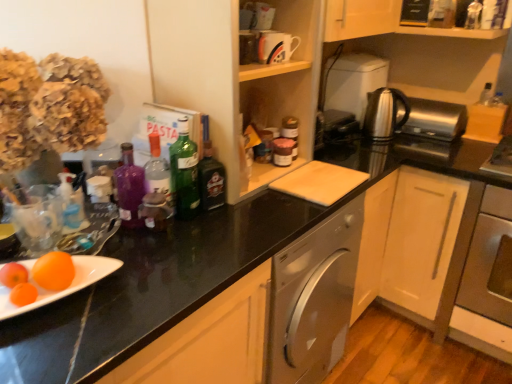
Question: From the image's perspective, would you say glossy ceramic mug at upper center, the third appliance in the right-to-left sequence, is shown under stainless steel oven at lower right?

Choices:
 (A) yes
 (B) no

Answer: (B)

Question: From a real-world perspective, is glossy ceramic mug at upper center, marked as the 1th appliance in a front-to-back arrangement, on stainless steel oven at lower right?

Choices:
 (A) yes
 (B) no

Answer: (A)

Question: From a real-world perspective, does glossy ceramic mug at upper center, the first appliance from the left, sit lower than stainless steel oven at lower right?

Choices:
 (A) no
 (B) yes

Answer: (A)

Question: Is glossy ceramic mug at upper center, the third appliance in the right-to-left sequence, taller than stainless steel oven at lower right?

Choices:
 (A) no
 (B) yes

Answer: (A)

Question: Considering the relative sizes of glossy ceramic mug at upper center, the third appliance in the right-to-left sequence, and stainless steel oven at lower right in the image provided, is glossy ceramic mug at upper center, the third appliance in the right-to-left sequence, bigger than stainless steel oven at lower right?

Choices:
 (A) yes
 (B) no

Answer: (B)

Question: Could you tell me if glossy ceramic mug at upper center, the first appliance from the left, is facing stainless steel oven at lower right?

Choices:
 (A) yes
 (B) no

Answer: (B)

Question: Is purple glass bottle at center, the first bottle positioned from the left, facing away from orange matte at lower left?

Choices:
 (A) no
 (B) yes

Answer: (A)

Question: Is purple glass bottle at center, the first bottle positioned from the left, closer to the viewer compared to orange matte at lower left?

Choices:
 (A) no
 (B) yes

Answer: (A)

Question: Is the position of purple glass bottle at center, which is the 4th bottle in right-to-left order, more distant than that of orange matte at lower left?

Choices:
 (A) no
 (B) yes

Answer: (B)

Question: Is purple glass bottle at center, which is the 4th bottle in right-to-left order, thinner than orange matte at lower left?

Choices:
 (A) no
 (B) yes

Answer: (B)

Question: From a real-world perspective, is purple glass bottle at center, the first bottle positioned from the left, located beneath orange matte at lower left?

Choices:
 (A) yes
 (B) no

Answer: (B)

Question: Considering the relative sizes of purple glass bottle at center, the first bottle positioned from the left, and orange matte at lower left in the image provided, is purple glass bottle at center, the first bottle positioned from the left, wider than orange matte at lower left?

Choices:
 (A) yes
 (B) no

Answer: (B)

Question: From the image's perspective, would you say orange matte at lower left is shown under green glass bottle at center, which is the 3th bottle in left-to-right order?

Choices:
 (A) yes
 (B) no

Answer: (A)